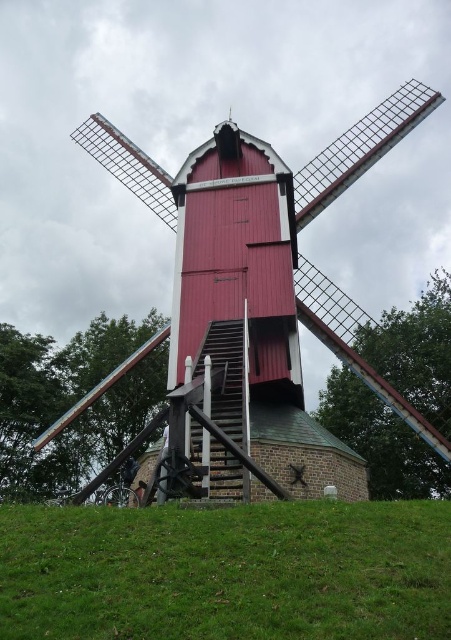
Question: Can you confirm if green grassy hill at lower center is smaller than wooden windmill at center?

Choices:
 (A) no
 (B) yes

Answer: (B)

Question: Is green grassy hill at lower center positioned behind wooden windmill at center?

Choices:
 (A) no
 (B) yes

Answer: (A)

Question: Where is green grassy hill at lower center located in relation to wooden windmill at center in the image?

Choices:
 (A) above
 (B) below

Answer: (B)

Question: Which object is farther from the camera taking this photo?

Choices:
 (A) wooden windmill at center
 (B) green grassy hill at lower center

Answer: (A)

Question: Which point is closer to the camera taking this photo?

Choices:
 (A) (383, 552)
 (B) (101, 385)

Answer: (A)